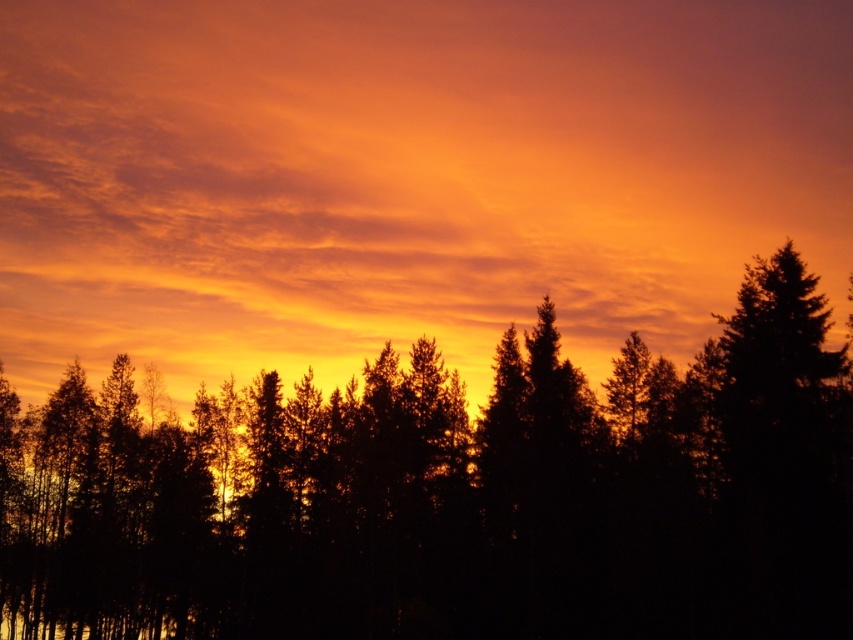
Based on the photo, who is positioned more to the right, orange matte cloud at upper center or black silhouetted trees at center?

Positioned to the right is black silhouetted trees at center.

Based on the photo, can you confirm if orange matte cloud at upper center is smaller than black silhouetted trees at center?

No, orange matte cloud at upper center is not smaller than black silhouetted trees at center.

Is point (810, 268) positioned before point (798, 625)?

No, (810, 268) is further to viewer.

Find the location of a particular element. orange matte cloud at upper center is located at coordinates (404, 177).